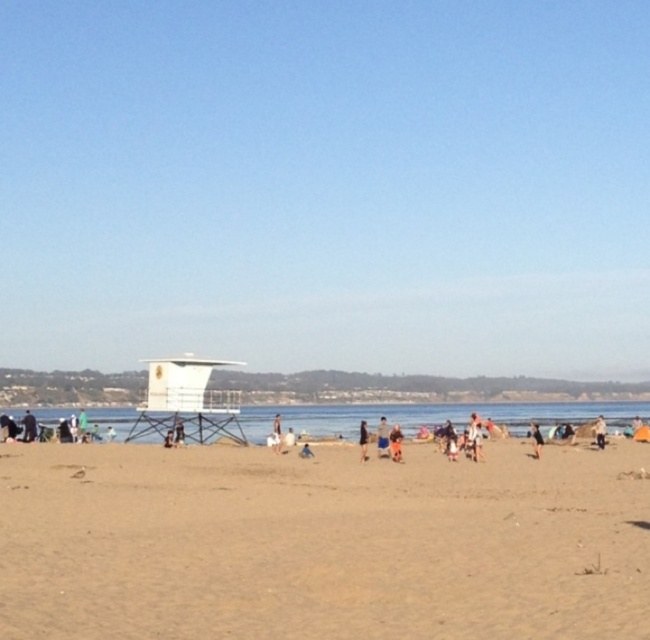
Is white plastic lifeguard tower at center positioned in front of dark blue jeans at center?

No, white plastic lifeguard tower at center is behind dark blue jeans at center.

Does point (452, 88) lie behind point (359, 445)?

Yes, it is behind point (359, 445).

Is point (476, 339) less distant than point (364, 444)?

No, it is not.

Image resolution: width=650 pixels, height=640 pixels. What are the coordinates of `white plastic lifeguard tower at center` in the screenshot? It's located at (326, 184).

Is point (73, 468) positioned behind point (603, 442)?

No, (73, 468) is in front of (603, 442).

The width and height of the screenshot is (650, 640). What do you see at coordinates (322, 541) in the screenshot? I see `brown sandy beach at lower left` at bounding box center [322, 541].

Who is more distant from viewer, [31,481] or [598,433]?

Positioned behind is point [598,433].

Image resolution: width=650 pixels, height=640 pixels. I want to click on brown sandy beach at lower left, so click(x=322, y=541).

Who is more distant from viewer, (x=560, y=509) or (x=382, y=428)?

The point (x=382, y=428) is behind.

Does brown sandy beach at lower left have a greater width compared to tan fabric shorts at center?

Correct, the width of brown sandy beach at lower left exceeds that of tan fabric shorts at center.

Does point (390, 593) lie behind point (387, 438)?

No, (390, 593) is closer to viewer.

The image size is (650, 640). I want to click on brown sandy beach at lower left, so click(x=322, y=541).